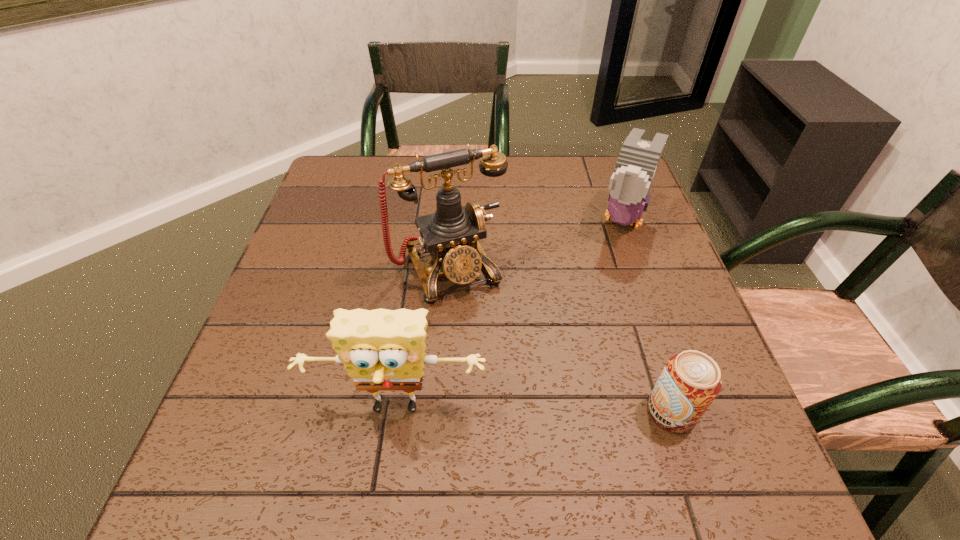
The image size is (960, 540). What are the coordinates of `sponge` in the screenshot? It's located at (383, 350).

Where is `beer can`? This screenshot has width=960, height=540. beer can is located at coordinates (690, 381).

Find the location of a particular element. This screenshot has height=540, width=960. bird is located at coordinates (638, 160).

Locate an element on the screen. telephone is located at coordinates (451, 235).

The height and width of the screenshot is (540, 960). I want to click on vacant space located 0.050m on the back of the beer can, so click(x=657, y=367).

Where is `vacant region located 0.190m at the beak of the bird`? vacant region located 0.190m at the beak of the bird is located at coordinates (594, 300).

Find the location of a particular element. Image resolution: width=960 pixels, height=540 pixels. vacant space located 0.250m at the beak of the bird is located at coordinates (587, 320).

Locate an element on the screen. The height and width of the screenshot is (540, 960). vacant area situated 0.140m at the beak of the bird is located at coordinates (601, 285).

The height and width of the screenshot is (540, 960). I want to click on vacant region located 0.180m on the front of the tallest object, featuring the rotary dial, so click(x=502, y=373).

You are a GUI agent. You are given a task and a screenshot of the screen. Output one action in this format:
    pyautogui.click(x=<x>, y=<y>)
    Task: Click on the vacant space situated on the front of the tallest object, featuring the rotary dial
    The width and height of the screenshot is (960, 540).
    Given the screenshot: What is the action you would take?
    pyautogui.click(x=519, y=409)